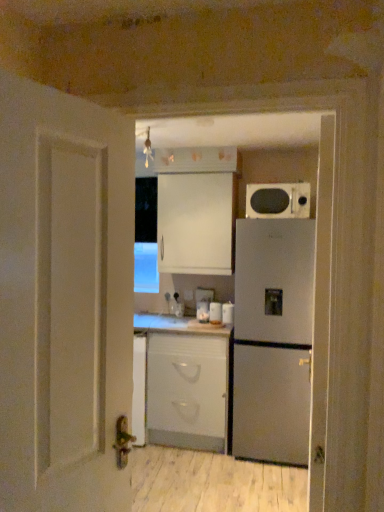
Question: Choose the correct answer: Is white glossy jar at center, the 2th appliance positioned from the right, inside matte black microwave at upper right or outside it?

Choices:
 (A) inside
 (B) outside

Answer: (B)

Question: From the image's perspective, is white glossy jar at center, the 2th appliance positioned from the right, above or below matte black microwave at upper right?

Choices:
 (A) below
 (B) above

Answer: (A)

Question: Estimate the real-world distances between objects in this image. Which object is farther from the white glossy jar at center, marked as the 2th appliance in a left-to-right arrangement?

Choices:
 (A) matte black microwave at upper right
 (B) satin silver refrigerator at right
 (C) white glossy jar at center, which is the third appliance in right-to-left order
 (D) white matte cabinet at center, which is the 1th cabinetry from bottom to top
 (E) white matte cabinet at upper center, arranged as the second cabinetry when ordered from the bottom

Answer: (A)

Question: Estimate the real-world distances between objects in this image. Which object is farther from the white matte cabinet at upper center, arranged as the second cabinetry when ordered from the bottom?

Choices:
 (A) matte black microwave at upper right
 (B) white glossy jar at center, marked as the 2th appliance in a left-to-right arrangement
 (C) white glossy jar at center, which is the third appliance in right-to-left order
 (D) white matte cabinet at center, which is the 1th cabinetry from bottom to top
 (E) white glossy canister at center, which is counted as the 3th appliance, starting from the left

Answer: (D)